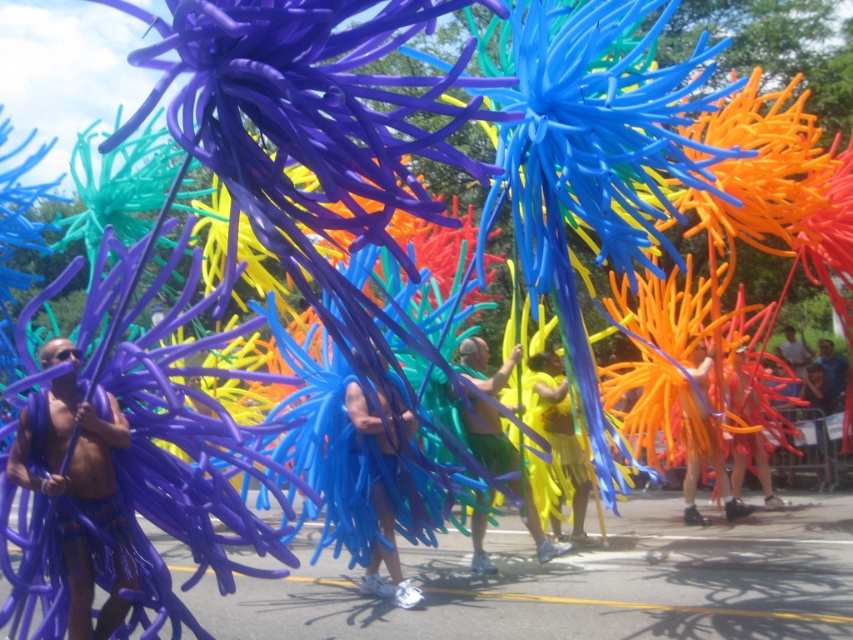
Question: Where is matte purple stick at left located in relation to matte blue fabric at center in the image?

Choices:
 (A) above
 (B) below

Answer: (A)

Question: Is yellow matte fabric at center smaller than matte blue fabric at center?

Choices:
 (A) no
 (B) yes

Answer: (A)

Question: Can you confirm if matte purple stick at left is positioned to the left of yellow matte fabric at center?

Choices:
 (A) yes
 (B) no

Answer: (A)

Question: Among these points, which one is farthest from the camera?

Choices:
 (A) pos(355,356)
 (B) pos(20,422)
 (C) pos(552,552)

Answer: (C)

Question: Which is nearer to the yellow matte fabric at center?

Choices:
 (A) matte blue fabric at center
 (B) matte purple stick at left

Answer: (A)

Question: Among these objects, which one is nearest to the camera?

Choices:
 (A) matte purple stick at left
 (B) matte blue fabric at center

Answer: (A)